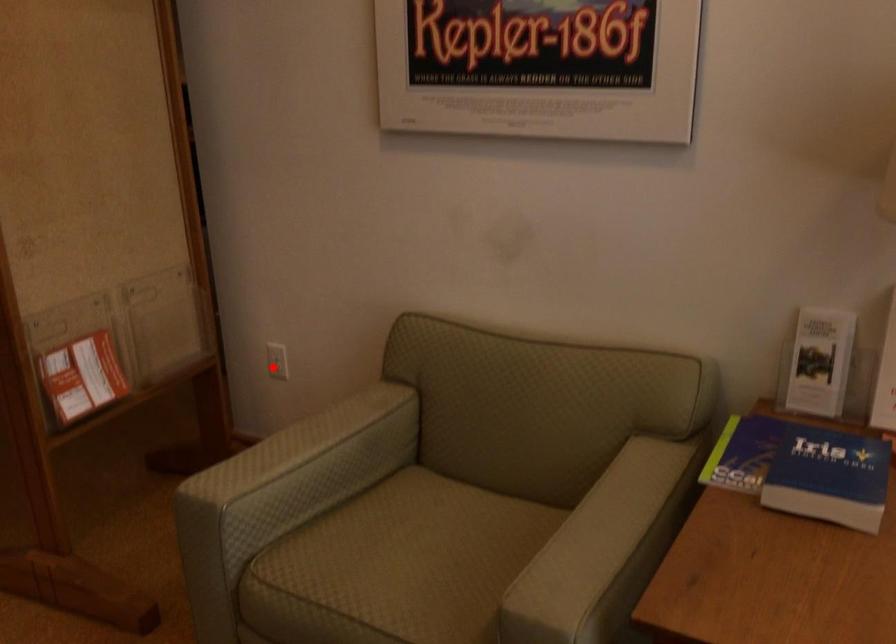
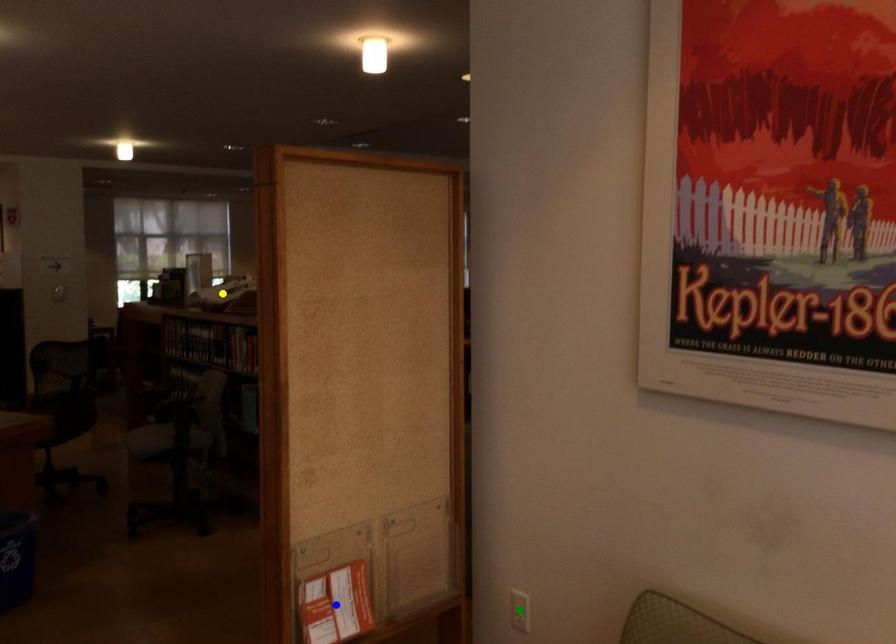
Question: I am providing you with two images of the same scene from different viewpoints. A red point is marked on the first image. You are given multiple points on the second image. Which point in image 2 is actually the same real-world point as the red point in image 1?

Choices:
 (A) blue point
 (B) green point
 (C) yellow point

Answer: (B)